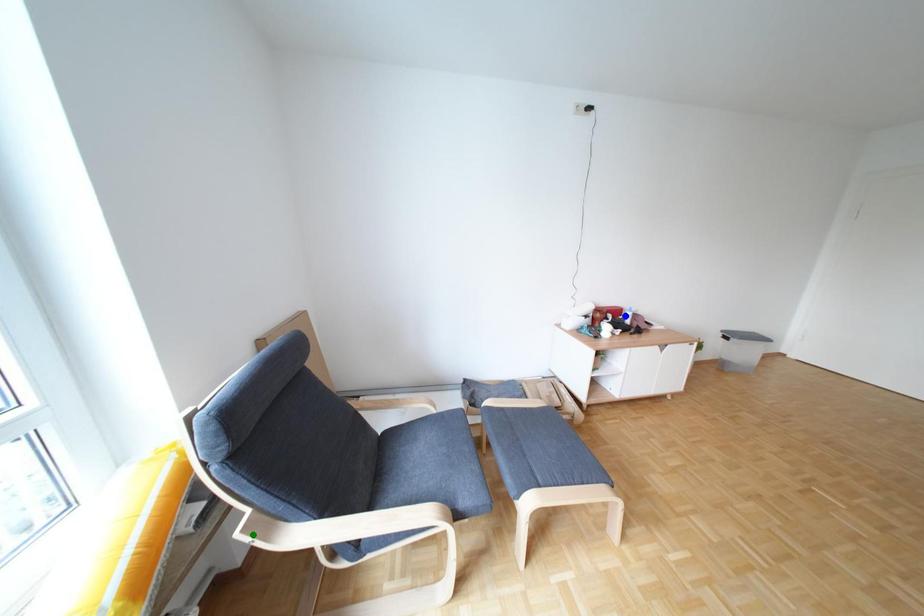
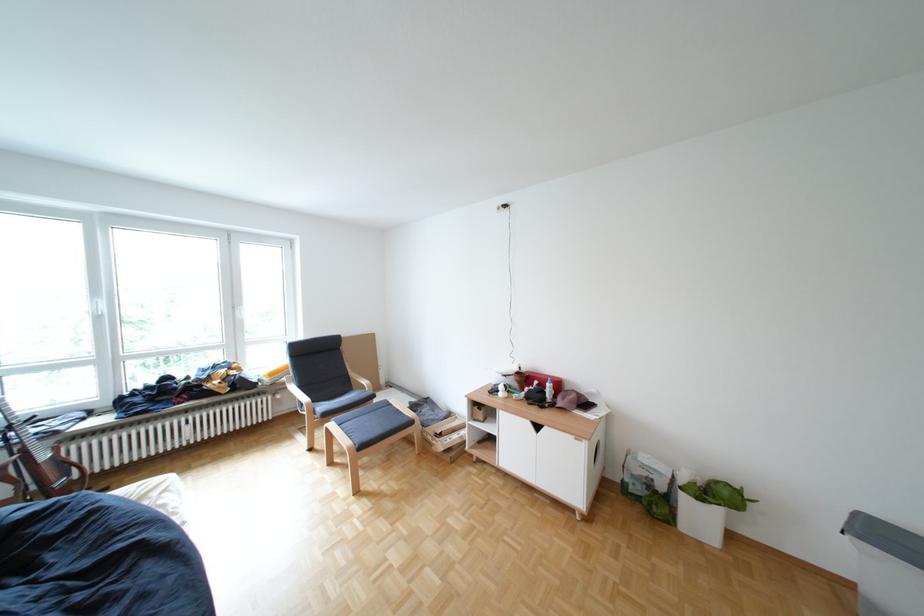
I am providing you with two images of the same scene from different viewpoints. Three points are marked in image1. Which point corresponds to a part or object that is occluded in image2?In image1, three points are marked. Which of them correspond to a part or object that is occluded in image2?Among the three points shown in image1, which one corresponds to a part or object that is no longer visible due to occlusion in image2?

green point